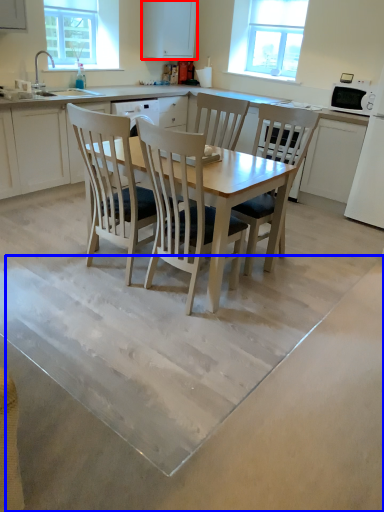
Question: Which object appears closest to the camera in this image, cabinetry (highlighted by a red box) or concrete (highlighted by a blue box)?

Choices:
 (A) cabinetry
 (B) concrete

Answer: (B)